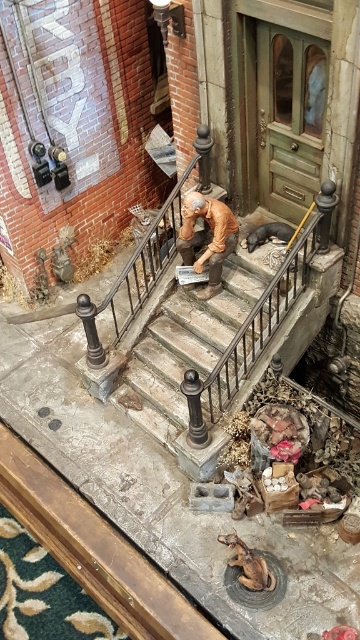
Question: Which point appears farthest from the camera in this image?

Choices:
 (A) (199, 212)
 (B) (266, 572)

Answer: (A)

Question: Can you confirm if matte brown figure at center is smaller than brown leather dog at lower center?

Choices:
 (A) no
 (B) yes

Answer: (A)

Question: Can you confirm if matte brown figure at center is positioned below brown leather dog at lower center?

Choices:
 (A) yes
 (B) no

Answer: (B)

Question: Does matte brown figure at center come behind brown leather dog at lower center?

Choices:
 (A) yes
 (B) no

Answer: (A)

Question: Which point appears closest to the camera in this image?

Choices:
 (A) (257, 557)
 (B) (195, 216)

Answer: (A)